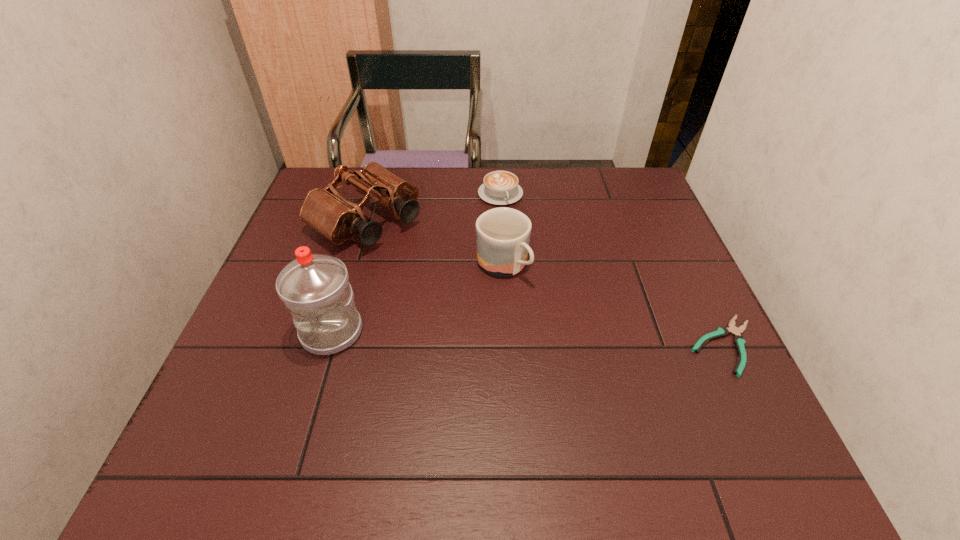
At what (x,y) coordinates should I click in order to perform the action: click on vacant space that is in between the shortest object and the fourth tallest object. Please return your answer as a coordinate pair (x, y). Looking at the image, I should click on (612, 269).

Identify the location of free space between the second shortest object and the tallest object. (416, 263).

Identify the location of free area in between the second tallest object and the tallest object. (349, 276).

Where is `free space between the third shortest object and the tallest object`? The width and height of the screenshot is (960, 540). free space between the third shortest object and the tallest object is located at coordinates (417, 299).

The width and height of the screenshot is (960, 540). Identify the location of empty space that is in between the water bottle and the binoculars. (349, 276).

Where is `vacant region between the binoculars and the water bottle`? The height and width of the screenshot is (540, 960). vacant region between the binoculars and the water bottle is located at coordinates (349, 276).

Locate an element on the screen. empty location between the mug and the shortest object is located at coordinates click(613, 306).

The height and width of the screenshot is (540, 960). I want to click on the fourth closest object to the rightmost object, so click(315, 288).

You are a GUI agent. You are given a task and a screenshot of the screen. Output one action in this format:
    pyautogui.click(x=<x>, y=<y>)
    Task: Click on the object that is the closest to the shortest object
    The height and width of the screenshot is (540, 960).
    Given the screenshot: What is the action you would take?
    pyautogui.click(x=503, y=234)

Find the location of a particular element. free location that satisfies the following two spatial constraints: 1. on the front side of the rightmost object; 2. on the left side of the third shortest object is located at coordinates (506, 346).